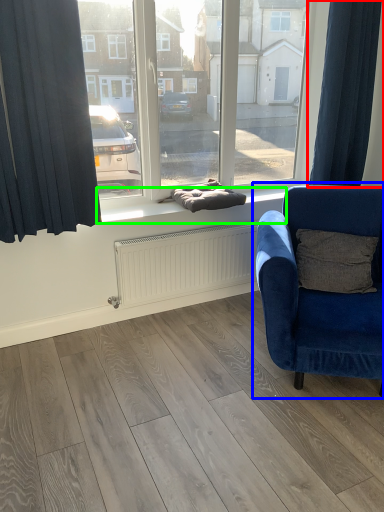
Question: Which object is positioned farthest from curtain (highlighted by a red box)? Select from chair (highlighted by a blue box) and window sill (highlighted by a green box).

Choices:
 (A) chair
 (B) window sill

Answer: (A)